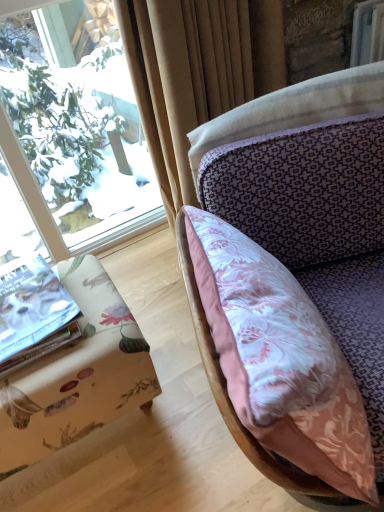
Question: Considering the relative positions of floral fabric ottoman at lower left and silky beige curtain at upper center in the image provided, is floral fabric ottoman at lower left to the left of silky beige curtain at upper center from the viewer's perspective?

Choices:
 (A) yes
 (B) no

Answer: (A)

Question: Is floral fabric ottoman at lower left further to the viewer compared to silky beige curtain at upper center?

Choices:
 (A) yes
 (B) no

Answer: (B)

Question: Is floral fabric ottoman at lower left with silky beige curtain at upper center?

Choices:
 (A) no
 (B) yes

Answer: (A)

Question: Is floral fabric ottoman at lower left facing towards silky beige curtain at upper center?

Choices:
 (A) yes
 (B) no

Answer: (B)

Question: Does floral fabric ottoman at lower left have a lesser height compared to silky beige curtain at upper center?

Choices:
 (A) yes
 (B) no

Answer: (A)

Question: In terms of height, does silky beige curtain at upper center look taller or shorter compared to white paper book at lower left?

Choices:
 (A) short
 (B) tall

Answer: (B)

Question: Considering their positions, is silky beige curtain at upper center located in front of or behind white paper book at lower left?

Choices:
 (A) front
 (B) behind

Answer: (B)

Question: Looking at the image, does silky beige curtain at upper center seem bigger or smaller compared to white paper book at lower left?

Choices:
 (A) big
 (B) small

Answer: (A)

Question: Considering the positions of point (233, 78) and point (0, 274), is point (233, 78) closer or farther from the camera than point (0, 274)?

Choices:
 (A) farther
 (B) closer

Answer: (A)

Question: From the image's perspective, is silky beige curtain at upper center positioned above or below floral fabric ottoman at lower left?

Choices:
 (A) below
 (B) above

Answer: (B)

Question: In the image, is silky beige curtain at upper center on the left side or the right side of floral fabric ottoman at lower left?

Choices:
 (A) left
 (B) right

Answer: (B)

Question: In terms of size, does silky beige curtain at upper center appear bigger or smaller than floral fabric ottoman at lower left?

Choices:
 (A) big
 (B) small

Answer: (A)

Question: In terms of width, does silky beige curtain at upper center look wider or thinner when compared to floral fabric ottoman at lower left?

Choices:
 (A) thin
 (B) wide

Answer: (A)

Question: From a real-world perspective, relative to silky beige curtain at upper center, is pink floral fabric pillow at center vertically above or below?

Choices:
 (A) below
 (B) above

Answer: (A)

Question: Considering the positions of pink floral fabric pillow at center and silky beige curtain at upper center in the image, is pink floral fabric pillow at center bigger or smaller than silky beige curtain at upper center?

Choices:
 (A) small
 (B) big

Answer: (A)